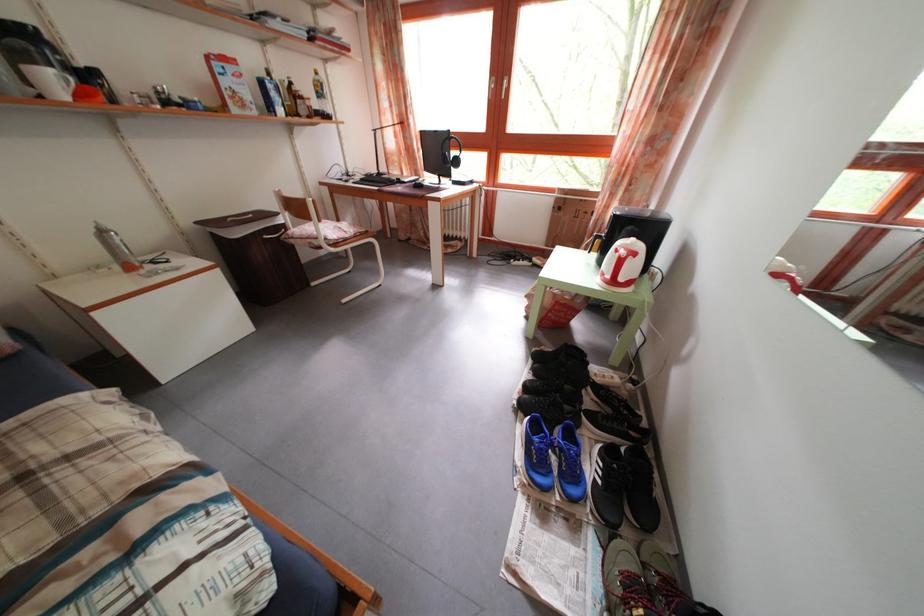
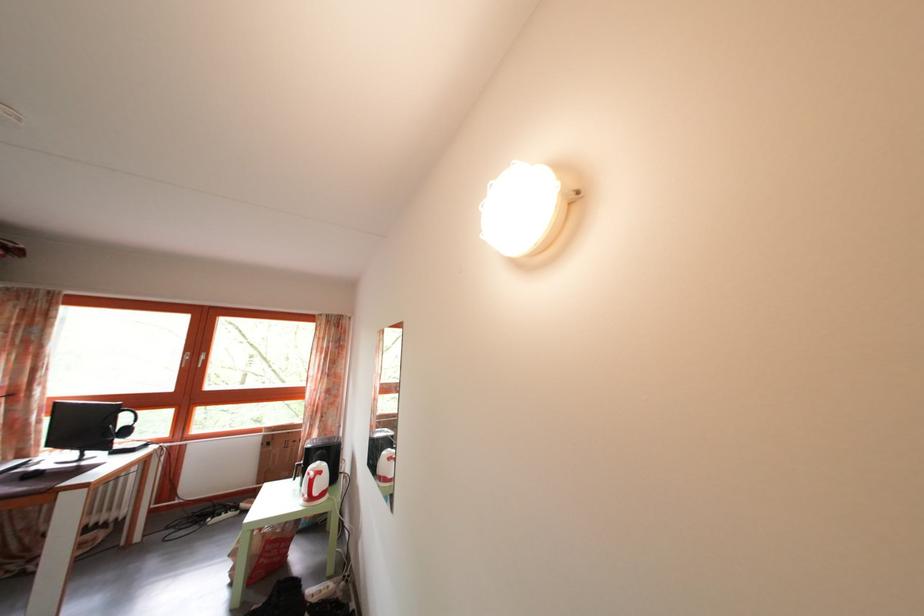
Where in the second image is the point corresponding to (x=529, y=262) from the first image?

(233, 514)